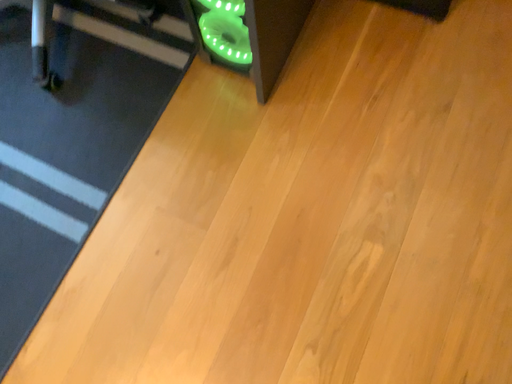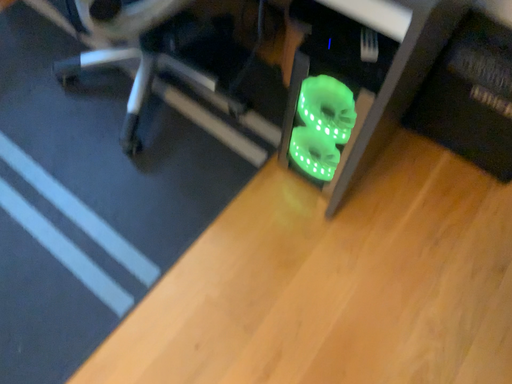
Question: Which way did the camera rotate in the video?

Choices:
 (A) rotated upward
 (B) rotated downward

Answer: (A)